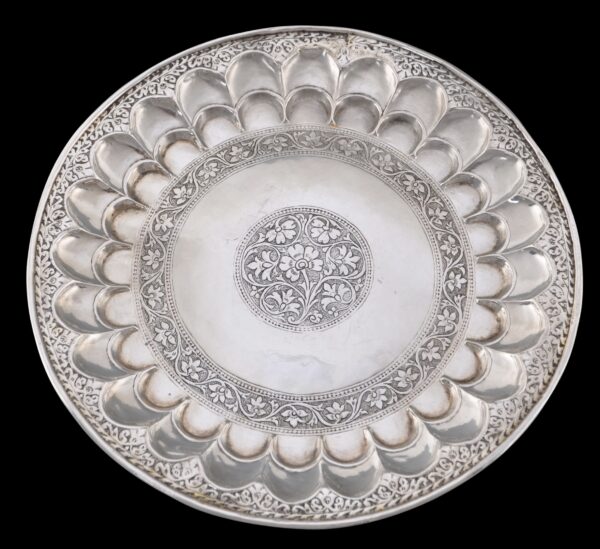
Find the location of `bottom of plate rim`. bottom of plate rim is located at coordinates (282, 524).